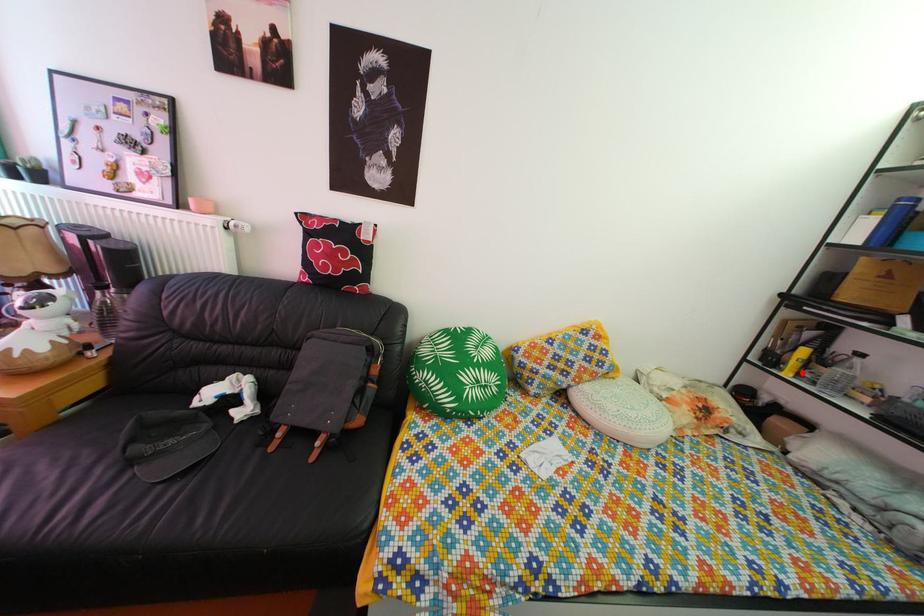
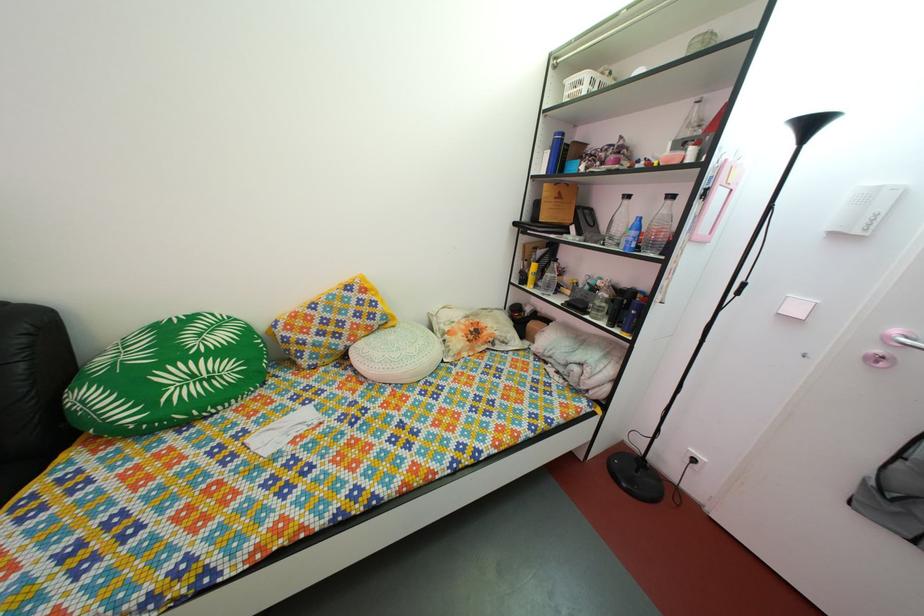
Find the pixel in the second image that matches the highlighted location in the first image.

(540, 286)